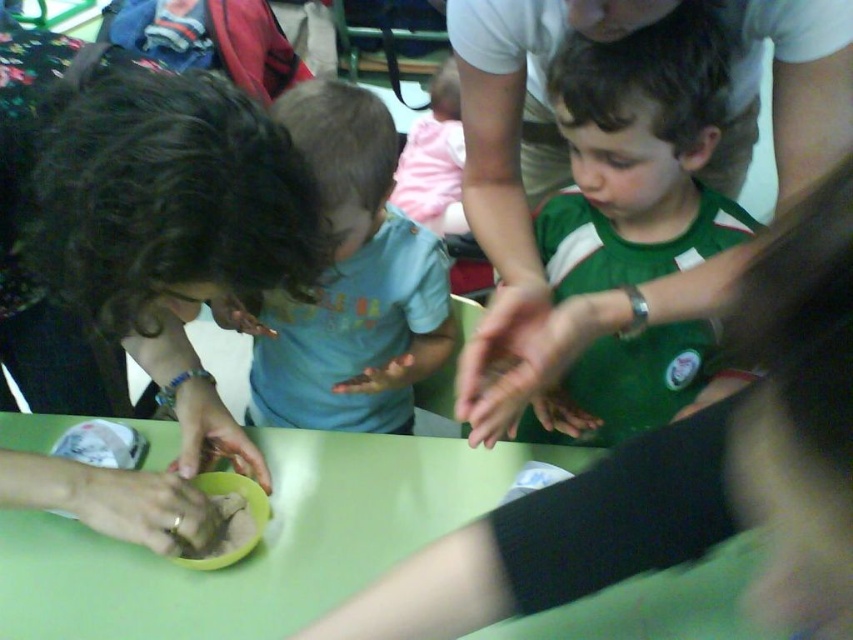
Is curly hair at left below green jersey at center?

Correct, curly hair at left is located below green jersey at center.

Does curly hair at left appear over green jersey at center?

No.

Which is behind, point (177, 236) or point (573, 241)?

Point (573, 241)

The height and width of the screenshot is (640, 853). I want to click on curly hair at left, so click(x=146, y=228).

Does green jersey at center have a greater height compared to matte brown clay at lower left?

Correct, green jersey at center is much taller as matte brown clay at lower left.

Is point (625, 93) less distant than point (219, 403)?

Yes, it is in front of point (219, 403).

Where is `green jersey at center`? Image resolution: width=853 pixels, height=640 pixels. green jersey at center is located at coordinates (637, 156).

Which is behind, point (49, 257) or point (345, 147)?

The point (345, 147) is more distant.

Does curly hair at left have a greater height compared to matte blue shirt at center?

Incorrect, curly hair at left's height is not larger of matte blue shirt at center's.

Is point (3, 268) less distant than point (384, 156)?

No, it is behind (384, 156).

This screenshot has width=853, height=640. I want to click on curly hair at left, so click(146, 228).